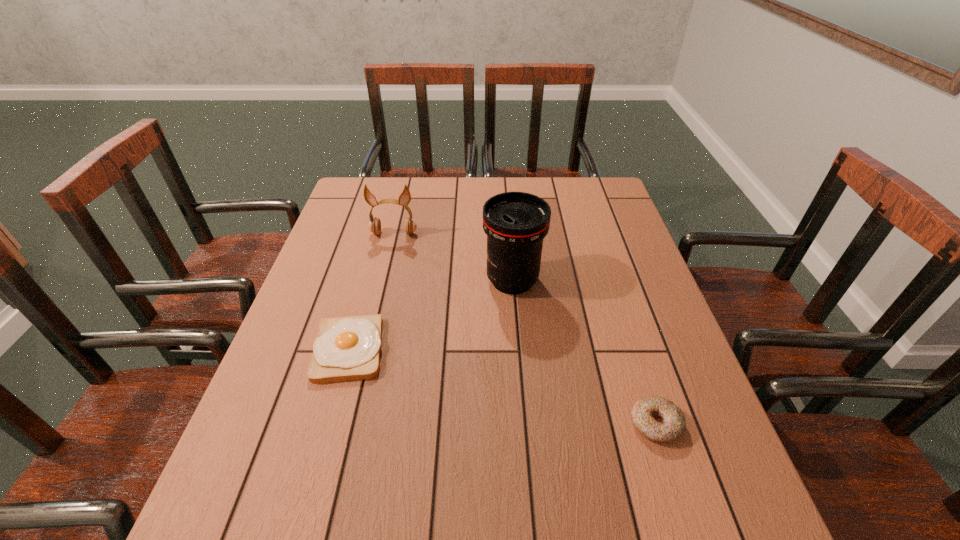
Locate an element on the screen. This screenshot has width=960, height=540. vacant space located 0.340m on the right of the toast is located at coordinates (533, 349).

I want to click on earphone at the left edge, so click(374, 226).

Where is `toast situated at the left edge`? The width and height of the screenshot is (960, 540). toast situated at the left edge is located at coordinates (347, 348).

Locate an element on the screen. object that is positioned at the right edge is located at coordinates (658, 419).

The width and height of the screenshot is (960, 540). In the image, there is a desktop. Identify the location of vacant space at the far edge. (469, 192).

In the image, there is a desktop. Identify the location of vacant space at the near edge. The height and width of the screenshot is (540, 960). (577, 516).

Identify the location of vacant space at the left edge. (333, 242).

The height and width of the screenshot is (540, 960). I want to click on blank area at the far left corner, so click(352, 201).

Where is `blank space at the near left corner of the desktop`? blank space at the near left corner of the desktop is located at coordinates (246, 519).

Where is `free space between the toast and the doughnut`? The height and width of the screenshot is (540, 960). free space between the toast and the doughnut is located at coordinates (502, 387).